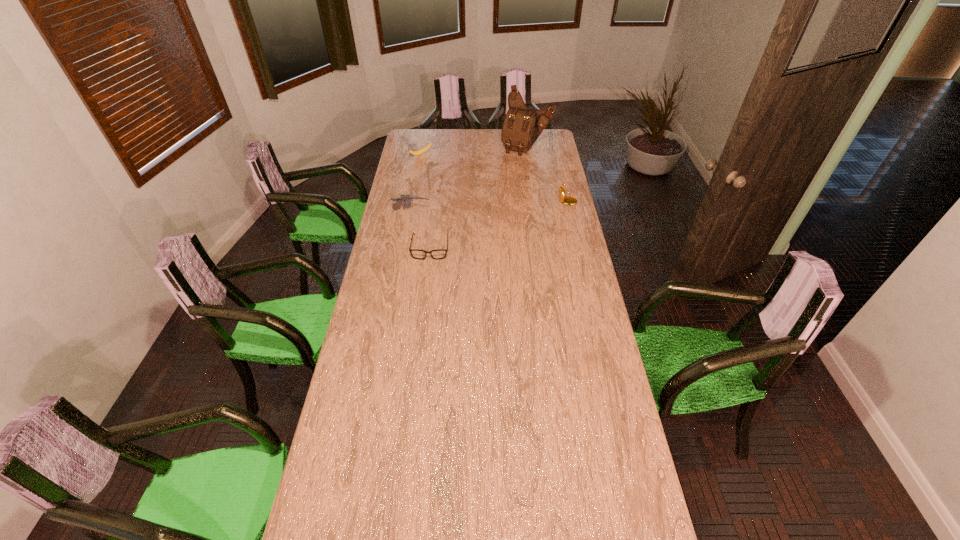
Find the location of a particular element. This screenshot has height=540, width=960. blank space located 0.190m on the front-facing side of the tallest object is located at coordinates (511, 172).

At what (x,y) coordinates should I click in order to perform the action: click on vacant region located 0.350m on the front-facing side of the tallest object. Please return your answer as a coordinate pair (x, y). This screenshot has height=540, width=960. Looking at the image, I should click on (502, 188).

Where is `vacant space located on the upward curve of the banana`? vacant space located on the upward curve of the banana is located at coordinates (434, 162).

Identify the location of free space located 0.400m on the upward curve of the banana. The height and width of the screenshot is (540, 960). (470, 188).

Image resolution: width=960 pixels, height=540 pixels. Find the location of `vacant space situated on the upward curve of the banana`. vacant space situated on the upward curve of the banana is located at coordinates (467, 185).

The width and height of the screenshot is (960, 540). What are the coordinates of `object that is at the far edge` in the screenshot? It's located at (522, 126).

At what (x,y) coordinates should I click in order to perform the action: click on spectacles that is positioned at the left edge. Please return your answer as a coordinate pair (x, y). The width and height of the screenshot is (960, 540). Looking at the image, I should click on (437, 254).

Where is `gun present at the left edge`? This screenshot has height=540, width=960. gun present at the left edge is located at coordinates (407, 199).

Find the location of `banana present at the left edge`. banana present at the left edge is located at coordinates (421, 151).

Find the location of a particular element. pocket watch present at the right edge is located at coordinates (568, 200).